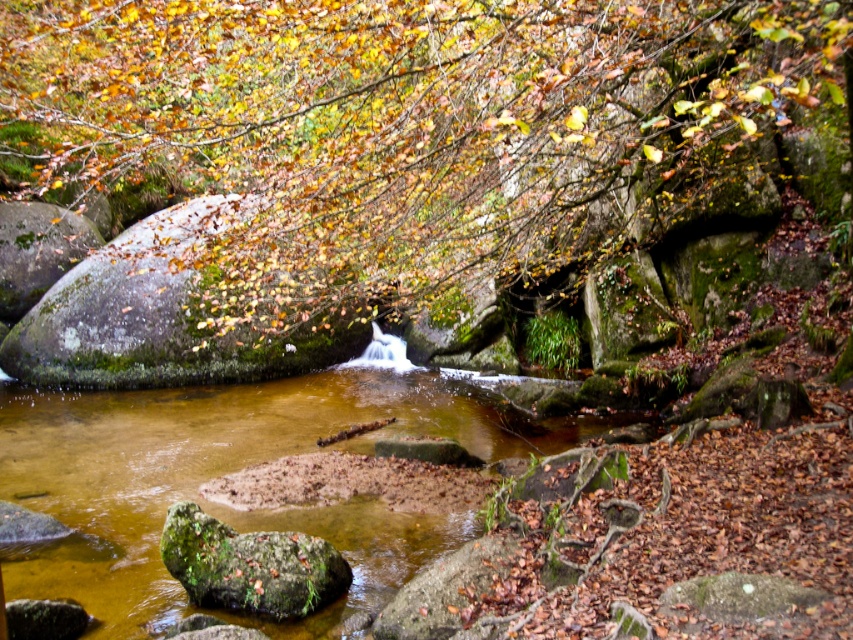
Who is higher up, green mossy rock at center or brown/muddy stream at center?

green mossy rock at center is above.

In the scene shown: Does green mossy rock at center have a smaller size compared to brown/muddy stream at center?

Incorrect, green mossy rock at center is not smaller in size than brown/muddy stream at center.

What do you see at coordinates (415, 129) in the screenshot? I see `green mossy rock at center` at bounding box center [415, 129].

You are a GUI agent. You are given a task and a screenshot of the screen. Output one action in this format:
    pyautogui.click(x=<x>, y=<y>)
    Task: Click on the green mossy rock at center
    Image resolution: width=853 pixels, height=640 pixels.
    Given the screenshot: What is the action you would take?
    pyautogui.click(x=415, y=129)

Does green mossy rock at center have a lesser height compared to green mossy rock at lower left?

No, green mossy rock at center is not shorter than green mossy rock at lower left.

Can you confirm if green mossy rock at center is taller than green mossy rock at lower left?

Yes, green mossy rock at center is taller than green mossy rock at lower left.

I want to click on green mossy rock at center, so click(x=415, y=129).

Find the location of a particular element. green mossy rock at center is located at coordinates (415, 129).

Which of these two, green mossy rock at upper left or green mossy rock at lower left, stands shorter?

With less height is green mossy rock at upper left.

Between point (138, 374) and point (254, 577), which one is positioned behind?

Positioned behind is point (138, 374).

This screenshot has height=640, width=853. Describe the element at coordinates (161, 314) in the screenshot. I see `green mossy rock at upper left` at that location.

You are a GUI agent. You are given a task and a screenshot of the screen. Output one action in this format:
    pyautogui.click(x=<x>, y=<y>)
    Task: Click on the green mossy rock at upper left
    
    Given the screenshot: What is the action you would take?
    pyautogui.click(x=161, y=314)